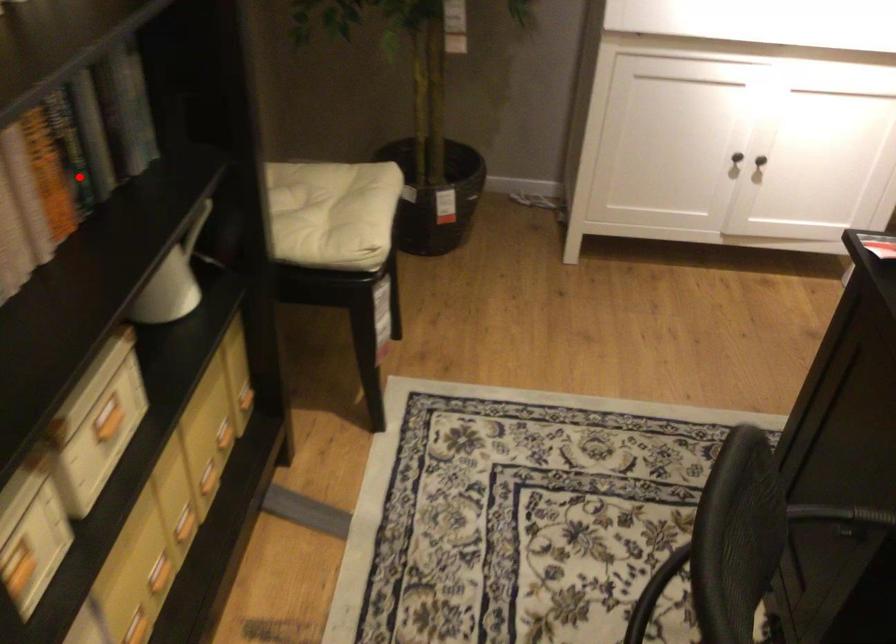
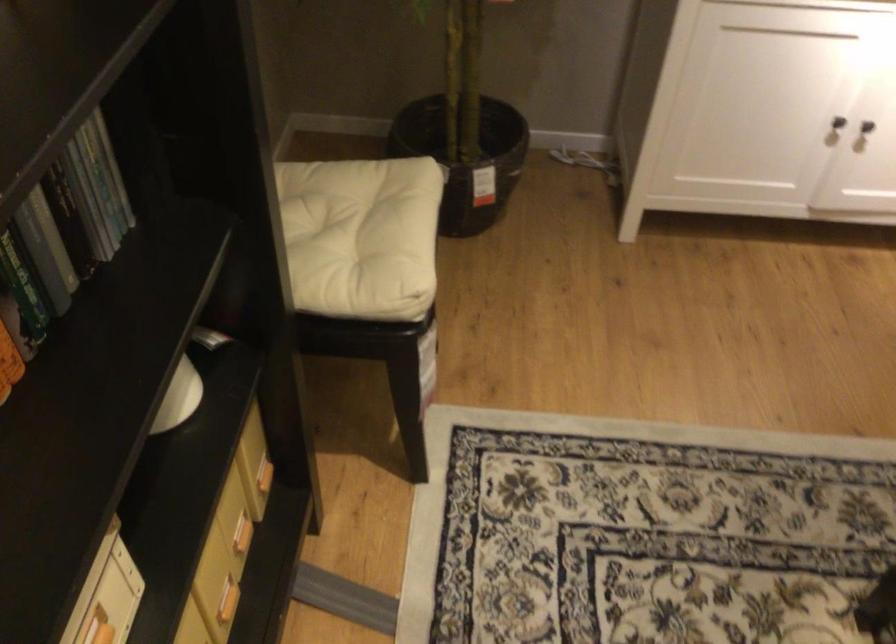
Question: A red point is marked in image1. In image2, is the corresponding 3D point closer to the camera or farther? Reply with the corresponding letter.

Choices:
 (A) The corresponding 3D point is closer.
 (B) The corresponding 3D point is farther.

Answer: (A)